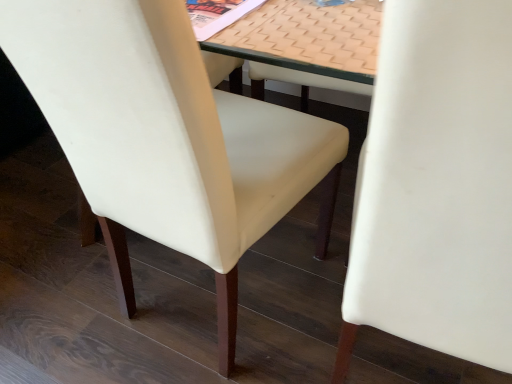
Question: From a real-world perspective, is beige textured mat at center positioned above or below white leather chair at center, which is counted as the 2th chair, starting from the left?

Choices:
 (A) below
 (B) above

Answer: (B)

Question: Choose the correct answer: Is beige textured mat at center inside white leather chair at center, which ranks as the 1th chair in right-to-left order, or outside it?

Choices:
 (A) outside
 (B) inside

Answer: (A)

Question: Which object is the closest to the beige textured mat at center?

Choices:
 (A) white leather chair at center, which is counted as the 2th chair, starting from the left
 (B) white leather chair at center, marked as the 2th chair in a right-to-left arrangement

Answer: (B)

Question: Based on their relative distances, which object is farther from the beige textured mat at center?

Choices:
 (A) white leather chair at center, marked as the first chair in a left-to-right arrangement
 (B) white leather chair at center, which ranks as the 1th chair in right-to-left order

Answer: (B)